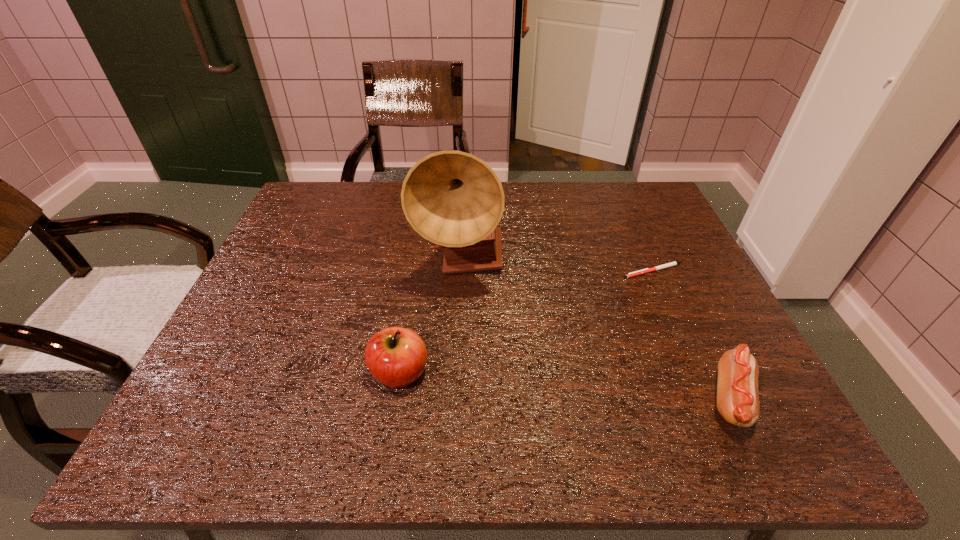
Locate an element on the screen. The height and width of the screenshot is (540, 960). vacant region at the far left corner of the desktop is located at coordinates (326, 184).

The image size is (960, 540). In order to click on vacant space at the far right corner in this screenshot , I will do `click(625, 224)`.

Locate an element on the screen. The height and width of the screenshot is (540, 960). blank region between the second shortest object and the third shortest object is located at coordinates [565, 386].

What are the coordinates of `vacant area that lies between the shortest object and the second tallest object` in the screenshot? It's located at (527, 322).

I want to click on vacant region between the sausage and the third shortest object, so click(565, 386).

Image resolution: width=960 pixels, height=540 pixels. What are the coordinates of `free space between the pen and the phonograph record` in the screenshot? It's located at (557, 267).

I want to click on free space between the pen and the sausage, so click(693, 335).

The image size is (960, 540). Identify the location of free space between the tallest object and the sausage. (596, 332).

You are a GUI agent. You are given a task and a screenshot of the screen. Output one action in this format:
    pyautogui.click(x=<x>, y=<y>)
    Task: Click on the vacant space in between the sausage and the pen
    The image size is (960, 540).
    Given the screenshot: What is the action you would take?
    pyautogui.click(x=693, y=335)

In order to click on blank region between the pen and the sausage in this screenshot , I will do `click(693, 335)`.